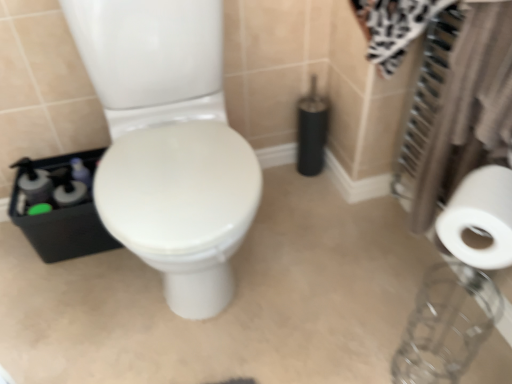
Locate an element on the screen. Image resolution: width=512 pixels, height=384 pixels. free spot to the left of white glossy toilet at center is located at coordinates (59, 299).